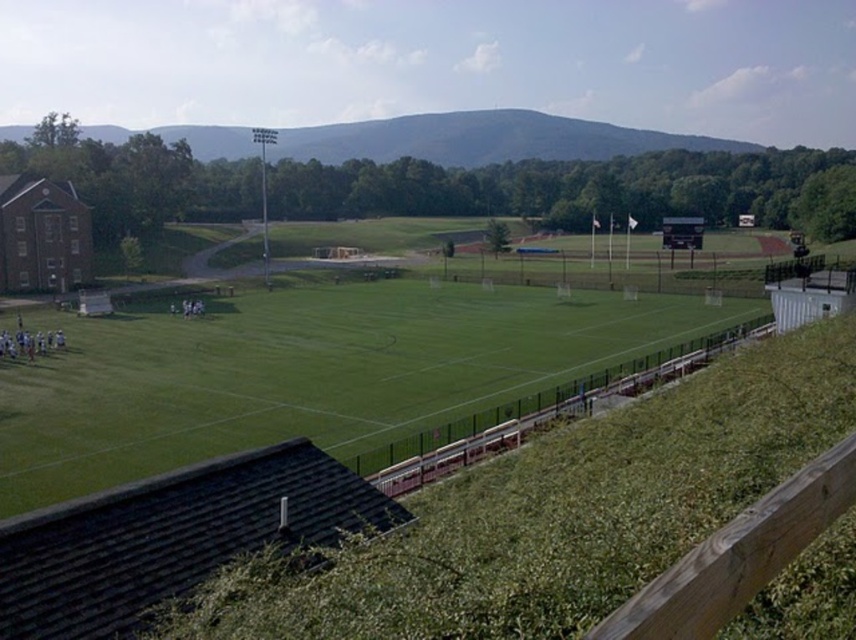
You are a photographer standing behind the fence trying to capture a photo of the green grass field at center and the brick building at left. Which object will appear closer to the camera in your photo?

The green grass field at center will appear closer to the camera because it is in front of the brick building at left.

You are standing at the origin point of the coordinate system. Where is the green grass field at center located in terms of coordinates?

The green grass field at center is located at coordinates point (306,371).

From the picture: You are standing at the edge of the sports field and want to throw a ball to a friend. You have two target points marked on the field at coordinates point (42, 460) and point (84, 216). Which point is closer to you so the ball doesn t have to travel as far?

Point (42, 460) is closer to the viewer than point (84, 216), so you should aim for that point to minimize the distance the ball has to travel.